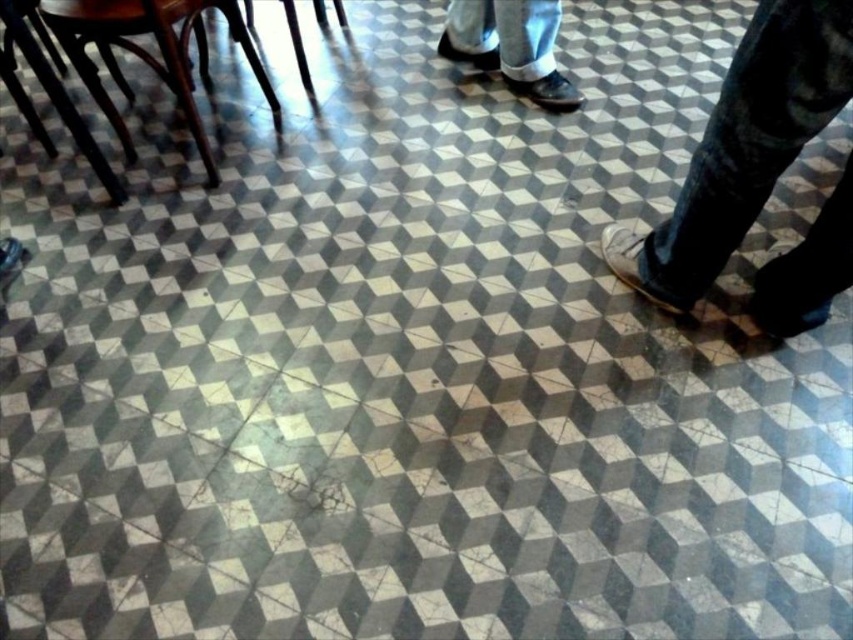
In the scene shown: You are standing at point [743,147] in the tiled floor area. You want to walk to the nearest exit, which is located at the upper left corner where the wooden chairs are. Which direction should you head towards?

The nearest exit is at the upper left corner where the wooden chairs are, so you should head towards the upper left direction from your current position at point [743,147].

You are standing on the tiled floor and see a brown leather shoe at lower right and a matte black shoe at upper center. Which shoe is bigger in size?

The brown leather shoe at lower right is larger in size than the matte black shoe at upper center.